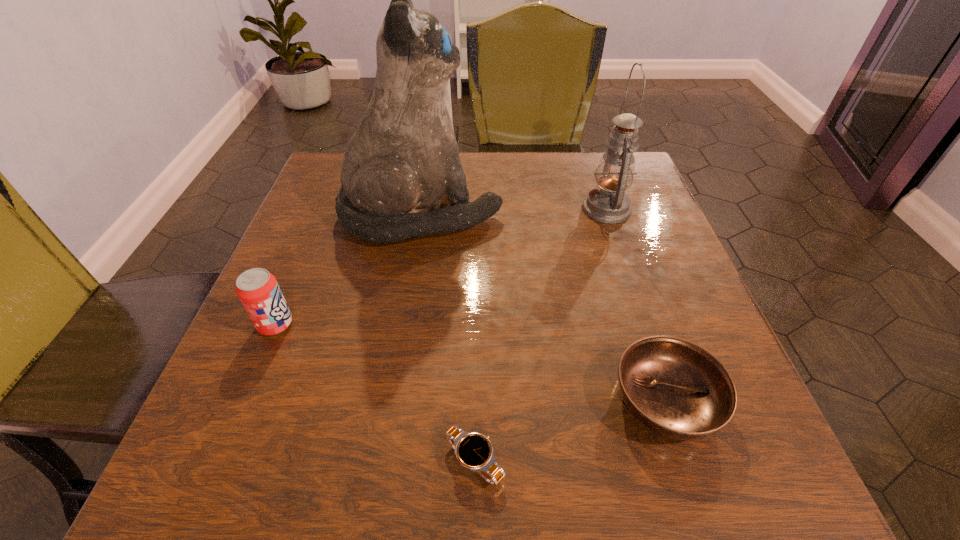
Where is `vacant region between the shortest object and the oil lamp`? vacant region between the shortest object and the oil lamp is located at coordinates (540, 335).

Identify the location of vacant area that lies between the oil lamp and the shortest object. This screenshot has width=960, height=540. (540, 335).

I want to click on vacant space that's between the fourth shortest object and the watch, so click(x=540, y=335).

The width and height of the screenshot is (960, 540). Identify the location of blank region between the oil lamp and the tallest object. (515, 211).

Identify the location of vacant space that's between the third tallest object and the second tallest object. The image size is (960, 540). (441, 267).

Identify the location of free spot between the soup bowl and the fourth shortest object. (636, 305).

Locate an element on the screen. This screenshot has width=960, height=540. unoccupied position between the third nearest object and the cat is located at coordinates (348, 269).

I want to click on object that is the third closest one to the tallest object, so click(674, 387).

Image resolution: width=960 pixels, height=540 pixels. In order to click on object that is the second closest to the fourth shortest object in this screenshot , I will do `click(674, 387)`.

You are a GUI agent. You are given a task and a screenshot of the screen. Output one action in this format:
    pyautogui.click(x=<x>, y=<y>)
    Task: Click on the vacant space that satisfies the following two spatial constraints: 1. on the surface of the soda can; 2. on the back side of the soup bowl
    
    Given the screenshot: What is the action you would take?
    pyautogui.click(x=244, y=401)